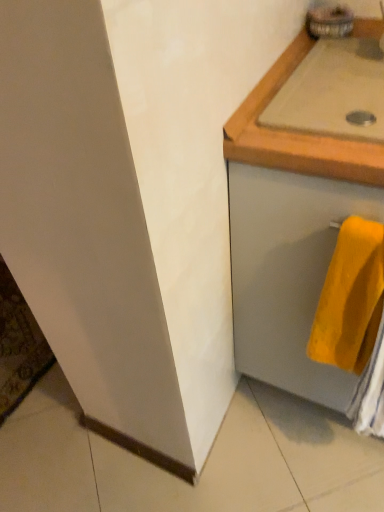
Question: Should I look upward or downward to see beige wood countertop at upper right?

Choices:
 (A) down
 (B) up

Answer: (B)

Question: From the image's perspective, is matte gray drawer at right located beneath yellow soft towel at lower right?

Choices:
 (A) yes
 (B) no

Answer: (B)

Question: Is matte gray drawer at right not close to yellow soft towel at lower right?

Choices:
 (A) no
 (B) yes

Answer: (A)

Question: Is matte gray drawer at right completely or partially outside of yellow soft towel at lower right?

Choices:
 (A) no
 (B) yes

Answer: (B)

Question: Considering the relative sizes of matte gray drawer at right and yellow soft towel at lower right in the image provided, is matte gray drawer at right smaller than yellow soft towel at lower right?

Choices:
 (A) yes
 (B) no

Answer: (B)

Question: Can you see matte gray drawer at right touching yellow soft towel at lower right?

Choices:
 (A) yes
 (B) no

Answer: (B)

Question: Is matte gray drawer at right surrounding yellow soft towel at lower right?

Choices:
 (A) yes
 (B) no

Answer: (A)

Question: Is beige wood countertop at upper right at the left side of yellow soft towel at lower right?

Choices:
 (A) yes
 (B) no

Answer: (B)

Question: Is beige wood countertop at upper right smaller than yellow soft towel at lower right?

Choices:
 (A) yes
 (B) no

Answer: (B)

Question: From a real-world perspective, is beige wood countertop at upper right physically below yellow soft towel at lower right?

Choices:
 (A) no
 (B) yes

Answer: (A)

Question: Does beige wood countertop at upper right appear on the right side of yellow soft towel at lower right?

Choices:
 (A) no
 (B) yes

Answer: (B)

Question: Is yellow soft towel at lower right located within beige wood countertop at upper right?

Choices:
 (A) no
 (B) yes

Answer: (A)

Question: Would you say beige wood countertop at upper right is a long distance from yellow soft towel at lower right?

Choices:
 (A) no
 (B) yes

Answer: (A)

Question: Is yellow soft towel at lower right facing away from beige wood countertop at upper right?

Choices:
 (A) yes
 (B) no

Answer: (B)